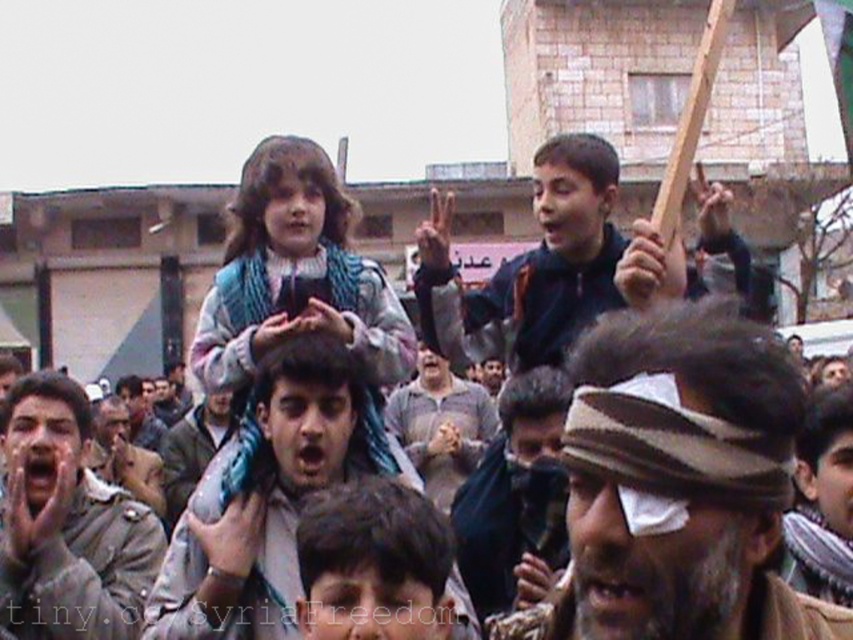
From the picture: You are standing in the middle of a protest scene with a point marked at coordinates (398, 531). Can you safely walk to that point without getting too close to the crowd?

The point at coordinates (398, 531) is 27.77 meters away from you, so yes, you can safely walk to that point without getting too close to the crowd since it is a considerable distance away.